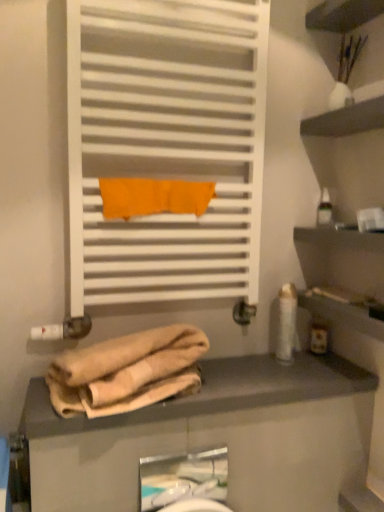
The height and width of the screenshot is (512, 384). In order to click on vacant space to the left of translucent plastic bottle at right, which ranks as the second toiletry in right-to-left order in this screenshot , I will do `click(261, 364)`.